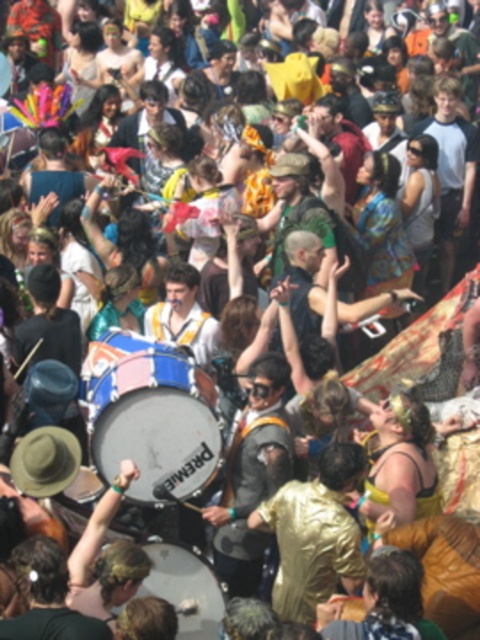
You are at a festival and want to take a photo of the drum performance. The matte blue drum at center and the white drum at center are both in the frame. Which drum is closer to the camera?

The matte blue drum at center is positioned over the white drum at center, so it is closer to the camera.

You are a festival attendee trying to take a photo of the drums. The matte blue drum at center and the white drum at center are both in your viewfinder. Based on their sizes, which drum would appear larger in your photo?

The matte blue drum at center might appear larger in the photo than the white drum at center because it might be wider.

You are a photographer positioned at the front of the crowd, and you want to take a photo of both the matte blue drum at center and the white drum at center. Which drum will appear larger in your photo?

The matte blue drum at center will appear larger in the photo because it is closer to the photographer than the white drum at center.